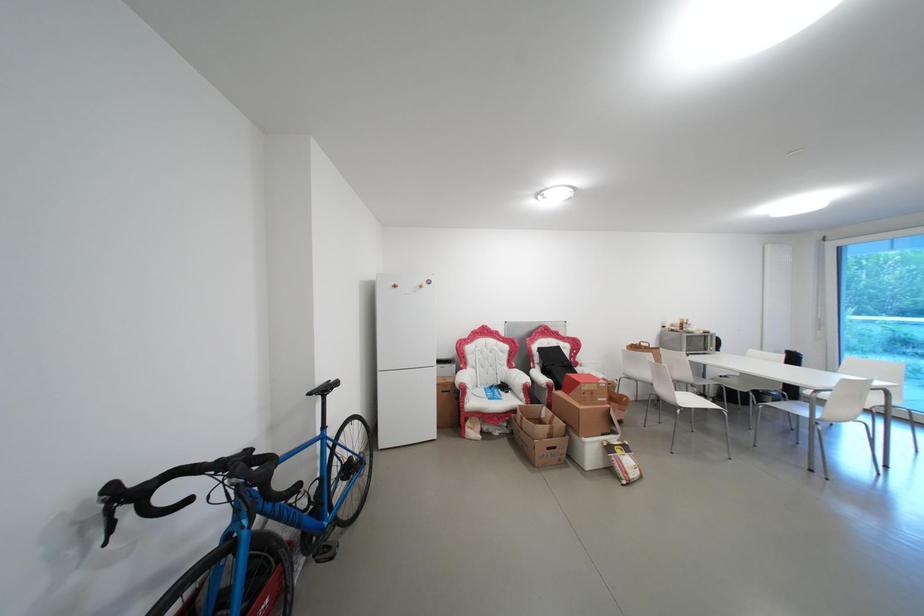
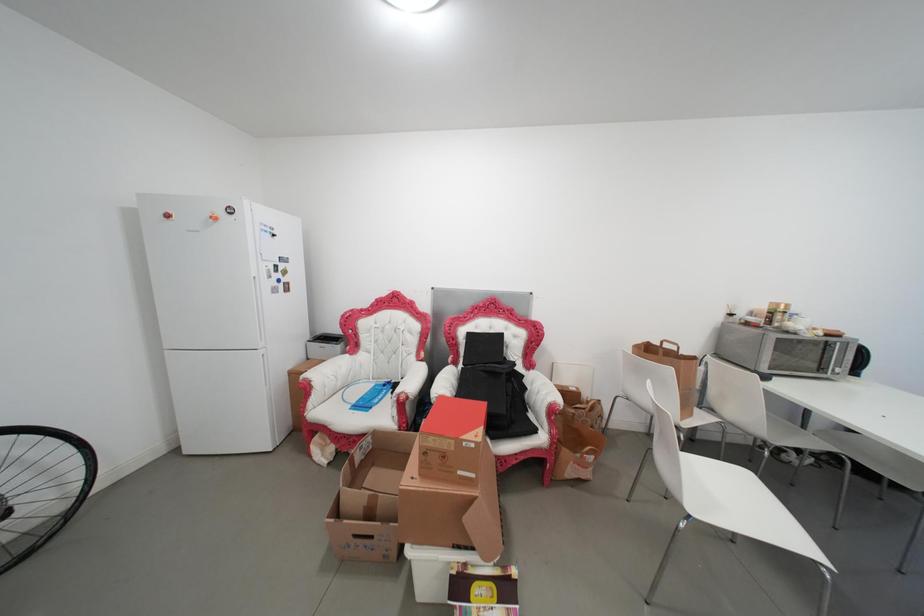
In a continuous first-person perspective shot, in which direction is the camera moving?

The cameraman moved toward right, forward.